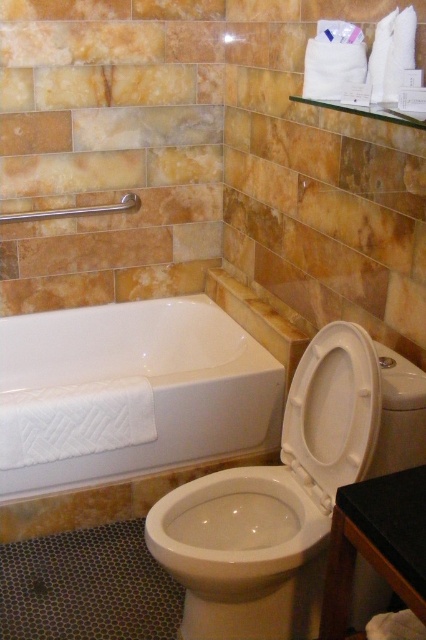
Does white plastic toilet seat at center appear on the left side of brushed metal towel bar at upper left?

In fact, white plastic toilet seat at center is to the right of brushed metal towel bar at upper left.

Looking at this image, is white plastic toilet seat at center below brushed metal towel bar at upper left?

Yes, white plastic toilet seat at center is below brushed metal towel bar at upper left.

Locate an element on the screen. This screenshot has height=640, width=426. white plastic toilet seat at center is located at coordinates (333, 412).

Which of these two, white glossy toilet at lower right or white glossy toilet bowl at center, stands shorter?

With less height is white glossy toilet bowl at center.

Between point (359, 566) and point (278, 566), which one is positioned in front?

Point (278, 566) is more forward.

Where is `white glossy toilet at lower right`? This screenshot has height=640, width=426. white glossy toilet at lower right is located at coordinates (290, 492).

Find the location of a particular element. The width and height of the screenshot is (426, 640). white glossy toilet at lower right is located at coordinates (290, 492).

The width and height of the screenshot is (426, 640). In order to click on white glossy toilet bowl at center in this screenshot , I will do `click(244, 554)`.

Does white glossy toilet bowl at center have a smaller size compared to brushed metal towel bar at upper left?

No, white glossy toilet bowl at center is not smaller than brushed metal towel bar at upper left.

In order to click on white glossy toilet bowl at center in this screenshot , I will do `click(244, 554)`.

At what (x,y) coordinates should I click in order to perform the action: click on white glossy toilet bowl at center. Please return your answer as a coordinate pair (x, y). The width and height of the screenshot is (426, 640). Looking at the image, I should click on coord(244,554).